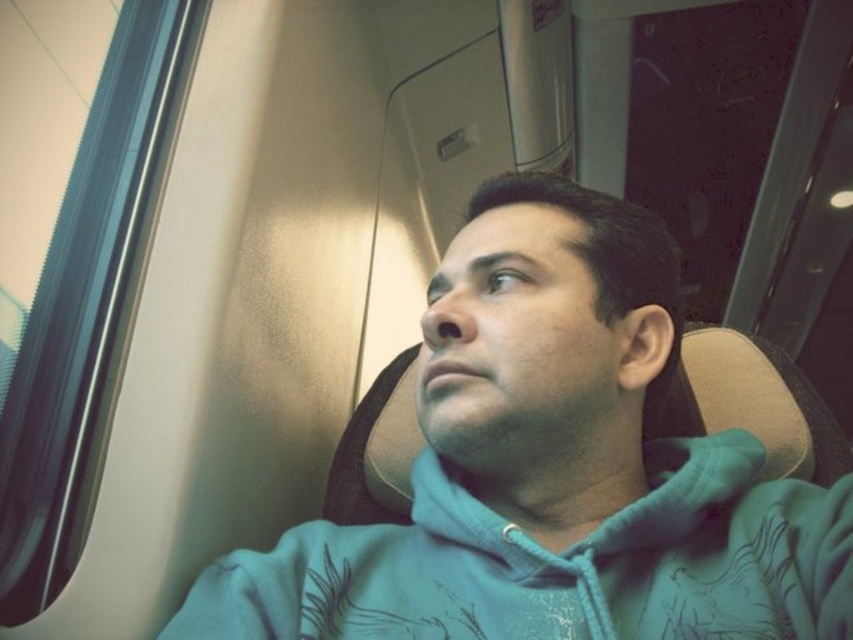
Question: Is teal hoodie at center in front of teal fleece sweatshirt at center?

Choices:
 (A) yes
 (B) no

Answer: (A)

Question: Is teal hoodie at center closer to camera compared to teal fleece sweatshirt at center?

Choices:
 (A) yes
 (B) no

Answer: (A)

Question: Is teal hoodie at center to the right of teal fleece sweatshirt at center from the viewer's perspective?

Choices:
 (A) no
 (B) yes

Answer: (B)

Question: Which of the following is the closest to the observer?

Choices:
 (A) teal hoodie at center
 (B) teal fleece sweatshirt at center

Answer: (A)